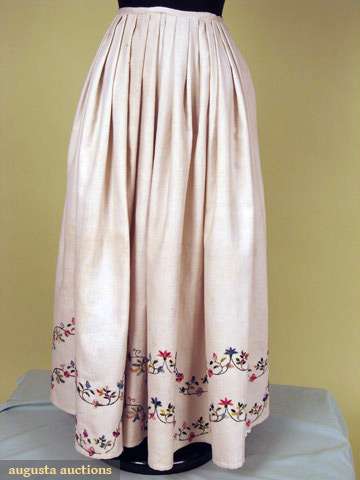
Image resolution: width=360 pixels, height=480 pixels. I want to click on sheet, so click(x=37, y=434), click(x=318, y=433).